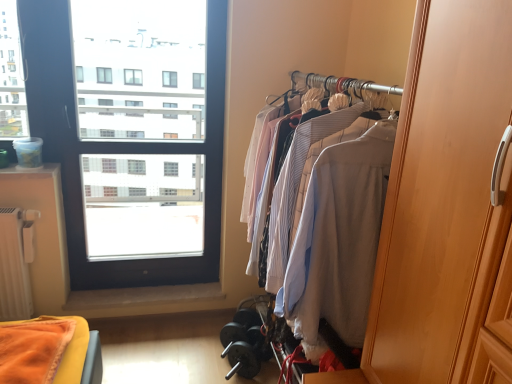
Question: Looking at the image, does wooden wardrobe at right seem bigger or smaller compared to light beige wood closet at right?

Choices:
 (A) big
 (B) small

Answer: (B)

Question: From their relative heights in the image, would you say wooden wardrobe at right is taller or shorter than light beige wood closet at right?

Choices:
 (A) short
 (B) tall

Answer: (A)

Question: Estimate the real-world distances between objects in this image. Which object is farther from the wooden wardrobe at right?

Choices:
 (A) transparent glass window at upper left
 (B) light beige wood closet at right

Answer: (A)

Question: Which object is positioned farthest from the light beige wood closet at right?

Choices:
 (A) wooden wardrobe at right
 (B) transparent glass window at upper left

Answer: (B)